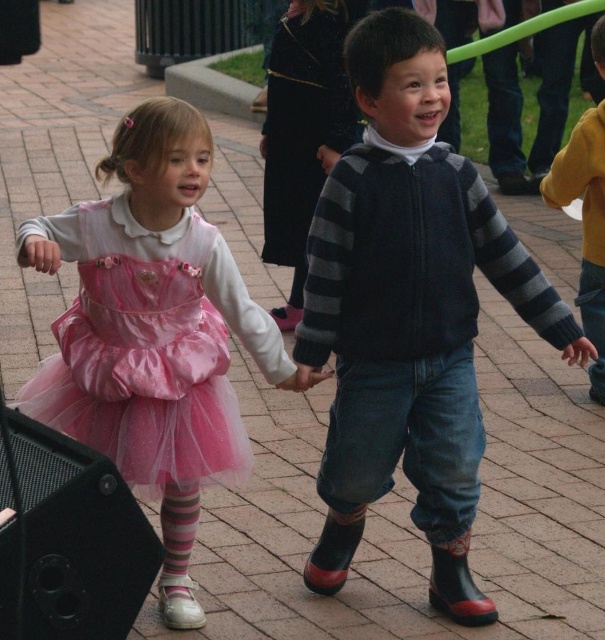
You are a photographer trying to capture the children in the scene. The pink satin dress at center is represented by point (152,332). Where should you position your camera to ensure the pink satin dress at center is in the center of the photo?

To center the pink satin dress at center, position the camera so that the point (152,332) aligns with the photo frame center.

You are a costume designer preparing for a play. You have two dresses available in the wardrobe scene described. Which dress has a larger width, the pink satin dress at center or the pink tulle dress at lower left?

The pink satin dress at center has a larger width than the pink tulle dress at lower left according to the description.